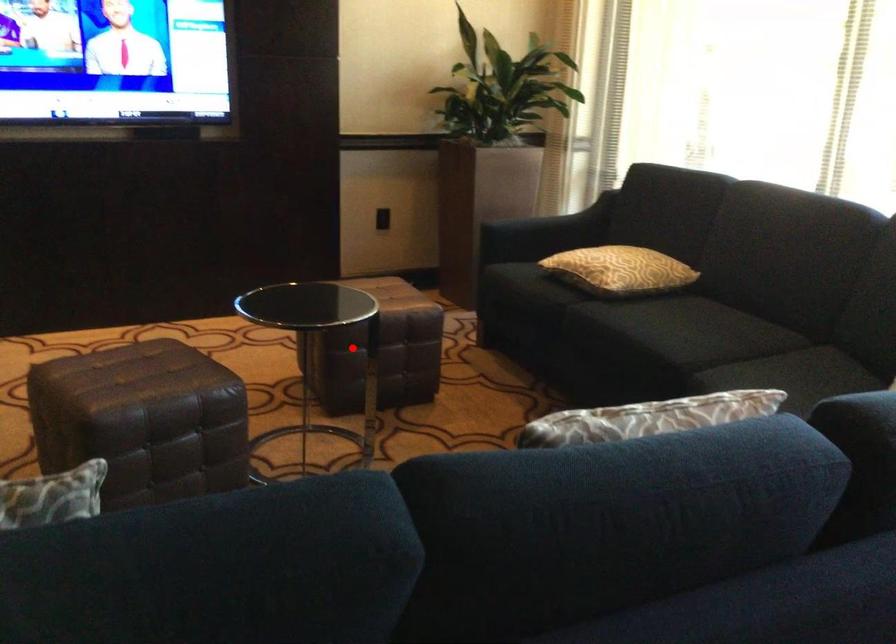
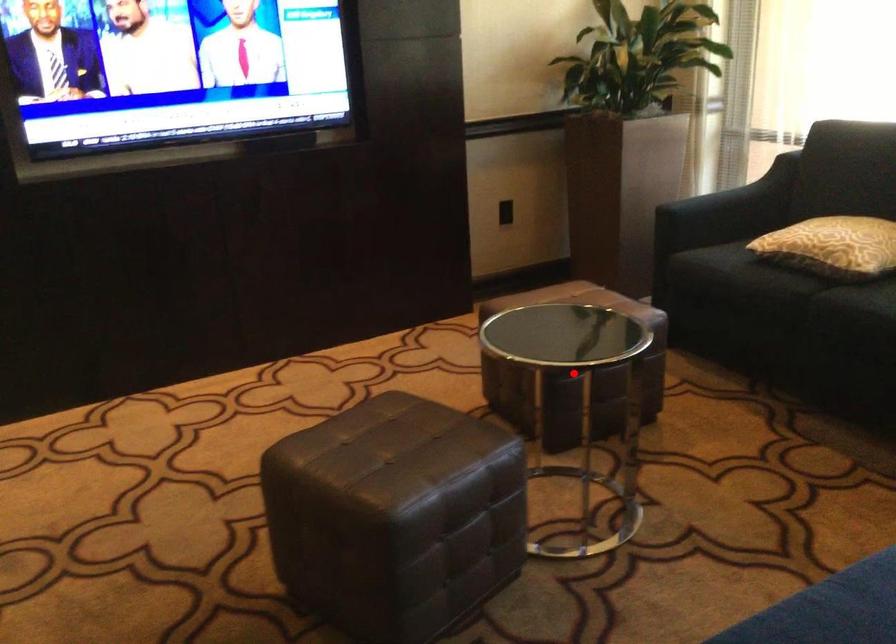
I am providing you with two images of the same scene from different viewpoints. A red point is marked on the first image and another point is marked on the second image. Is the red point in image1 aligned with the point shown in image2?

Yes